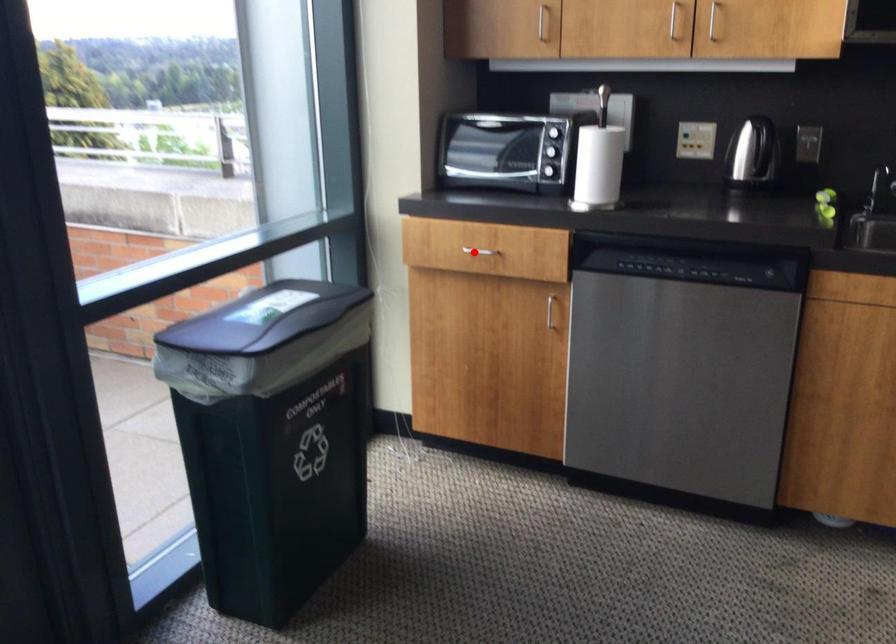
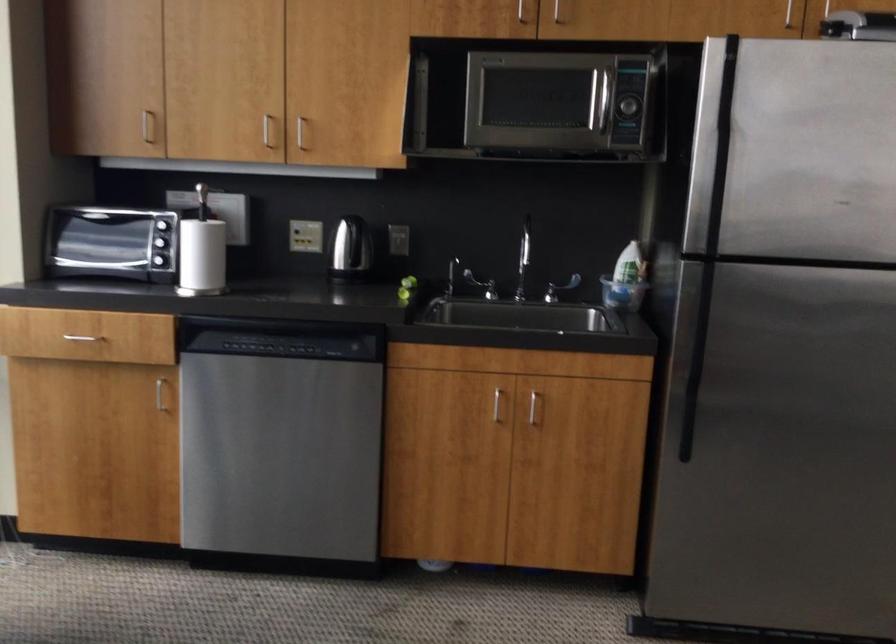
In the second image, find the point that corresponds to the highlighted location in the first image.

(82, 337)